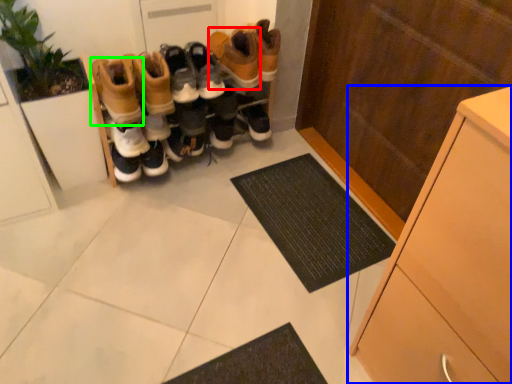
Question: Which is nearer to the footwear (highlighted by a red box)? cabinetry (highlighted by a blue box) or footwear (highlighted by a green box).

Choices:
 (A) cabinetry
 (B) footwear

Answer: (B)